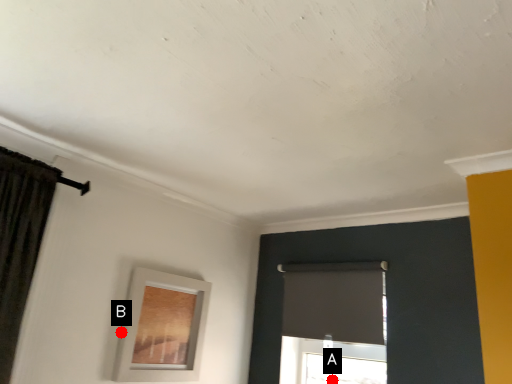
Question: Two points are circled on the image, labeled by A and B beside each circle. Which of the following is the farthest from the observer?

Choices:
 (A) A is further
 (B) B is further

Answer: (A)